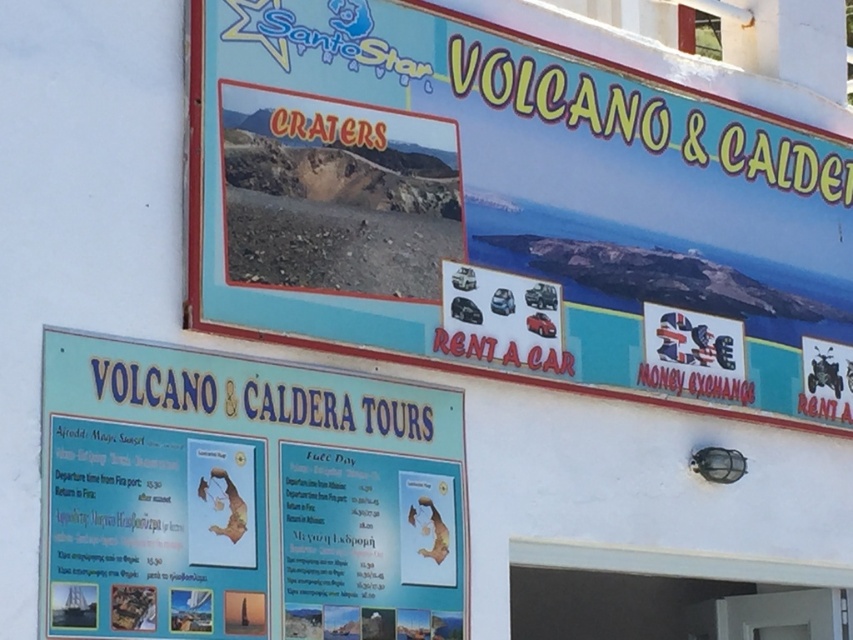
Question: Which point is closer to the camera?

Choices:
 (A) blue plastic signboard at upper center
 (B) blue paperboard sign at lower center

Answer: (B)

Question: Can you confirm if blue plastic signboard at upper center is positioned to the left of blue paperboard sign at lower center?

Choices:
 (A) yes
 (B) no

Answer: (B)

Question: Does blue plastic signboard at upper center appear over blue paperboard sign at lower center?

Choices:
 (A) no
 (B) yes

Answer: (B)

Question: Which object is farther from the camera taking this photo?

Choices:
 (A) blue paperboard sign at lower center
 (B) blue plastic signboard at upper center

Answer: (B)

Question: Can you confirm if blue plastic signboard at upper center is positioned to the left of blue paperboard sign at lower center?

Choices:
 (A) yes
 (B) no

Answer: (B)